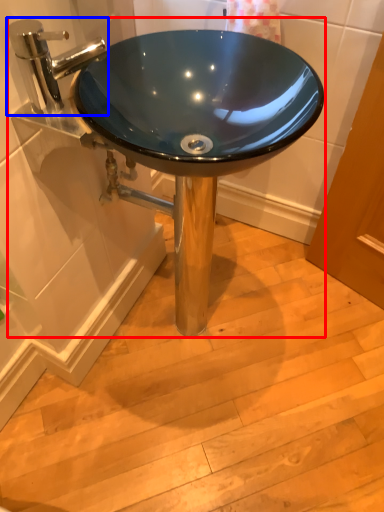
Question: Which object appears closest to the camera in this image, sink (highlighted by a red box) or tap (highlighted by a blue box)?

Choices:
 (A) sink
 (B) tap

Answer: (B)